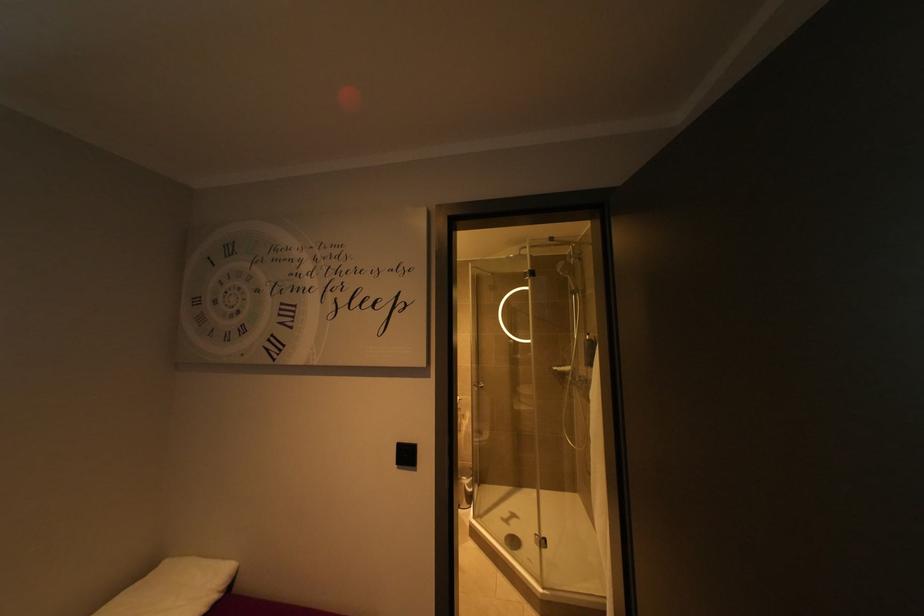
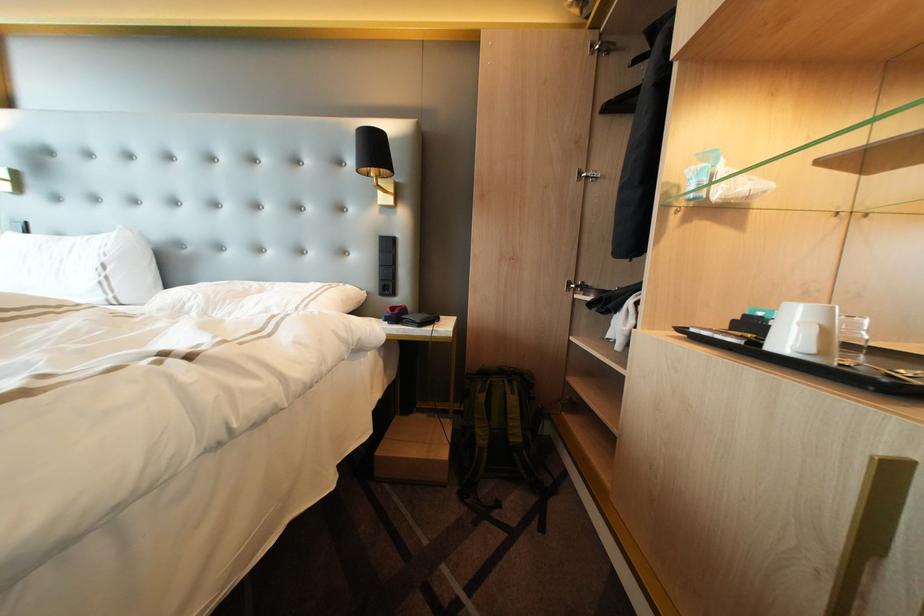
What movement of the cameraman would produce the second image?

The movement direction of the cameraman is left, forward.